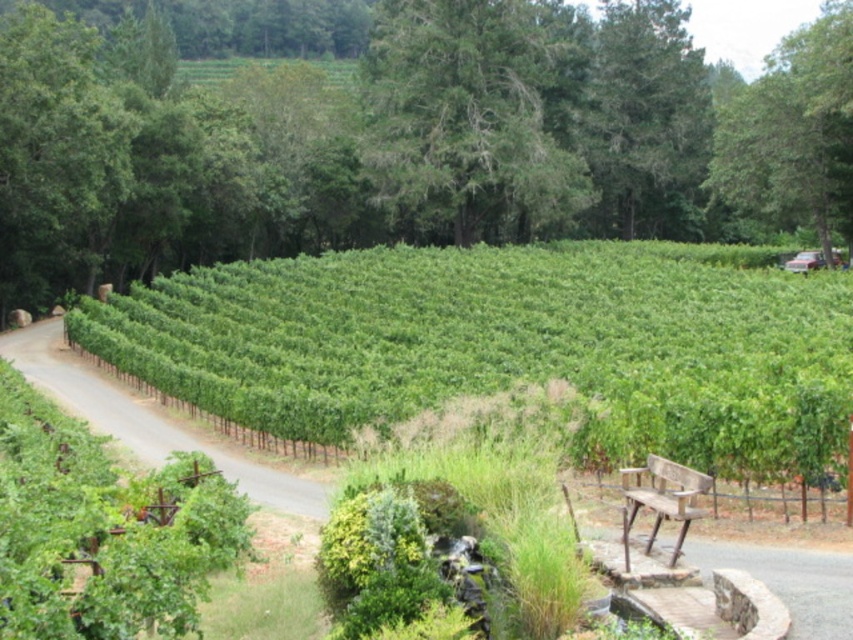
Does green leafy hedge at center have a greater width compared to green textured tree at center?

Correct, the width of green leafy hedge at center exceeds that of green textured tree at center.

The width and height of the screenshot is (853, 640). What are the coordinates of `green leafy hedge at center` in the screenshot? It's located at (509, 346).

In order to click on green leafy hedge at center in this screenshot , I will do (x=509, y=346).

Between point (769, 209) and point (650, 544), which one is positioned behind?

The point (769, 209) is behind.

Is point (820, 122) more distant than point (677, 552)?

Yes.

Who is more forward, (x=817, y=33) or (x=697, y=488)?

Point (x=697, y=488) is more forward.

At what (x,y) coordinates should I click in order to perform the action: click on green leafy tree at upper right. Please return your answer as a coordinate pair (x, y). This screenshot has width=853, height=640. Looking at the image, I should click on (793, 131).

Can you confirm if green leafy tree at upper center is positioned above wooden bench at lower right?

Yes.

Who is higher up, green leafy tree at upper center or wooden bench at lower right?

green leafy tree at upper center is above.

Find the location of `green leafy tree at upper center`. green leafy tree at upper center is located at coordinates (409, 140).